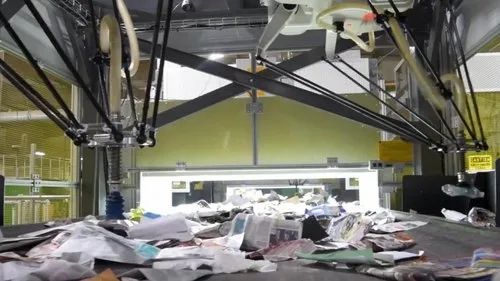
Image resolution: width=500 pixels, height=281 pixels. I want to click on table, so click(307, 274).